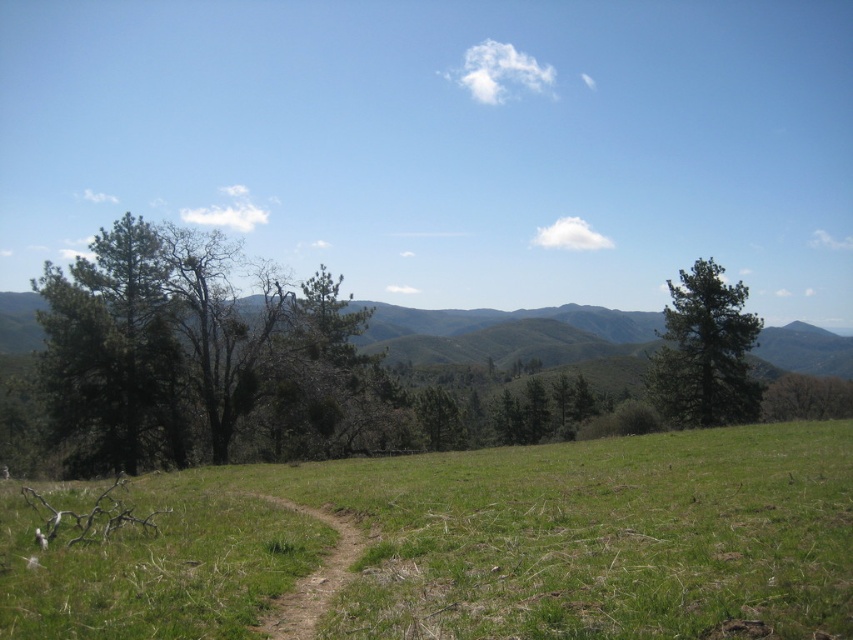
Question: Which object is the closest to the green grassy field at center?

Choices:
 (A) green textured mountain at center
 (B) green matte tree at left
 (C) brown dirt path at center
 (D) green matte tree at right

Answer: (C)

Question: Based on their relative distances, which object is farther from the green grassy field at center?

Choices:
 (A) brown dirt path at center
 (B) green matte tree at left
 (C) green matte tree at right
 (D) green textured mountain at center

Answer: (D)

Question: From the image, what is the correct spatial relationship of green textured mountain at center in relation to green matte tree at right?

Choices:
 (A) above
 (B) below

Answer: (A)

Question: Does green grassy field at center have a lesser width compared to green textured mountain at center?

Choices:
 (A) no
 (B) yes

Answer: (B)

Question: Is the position of green matte tree at right more distant than that of brown dirt path at center?

Choices:
 (A) no
 (B) yes

Answer: (B)

Question: Which of the following is the farthest from the observer?

Choices:
 (A) (392, 328)
 (B) (138, 448)
 (C) (521, 588)
 (D) (309, 609)

Answer: (A)